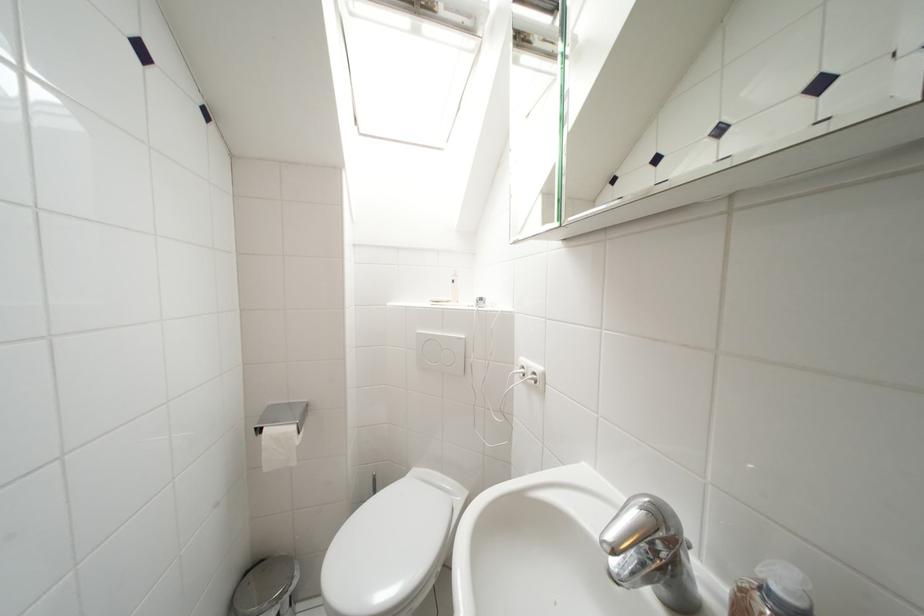
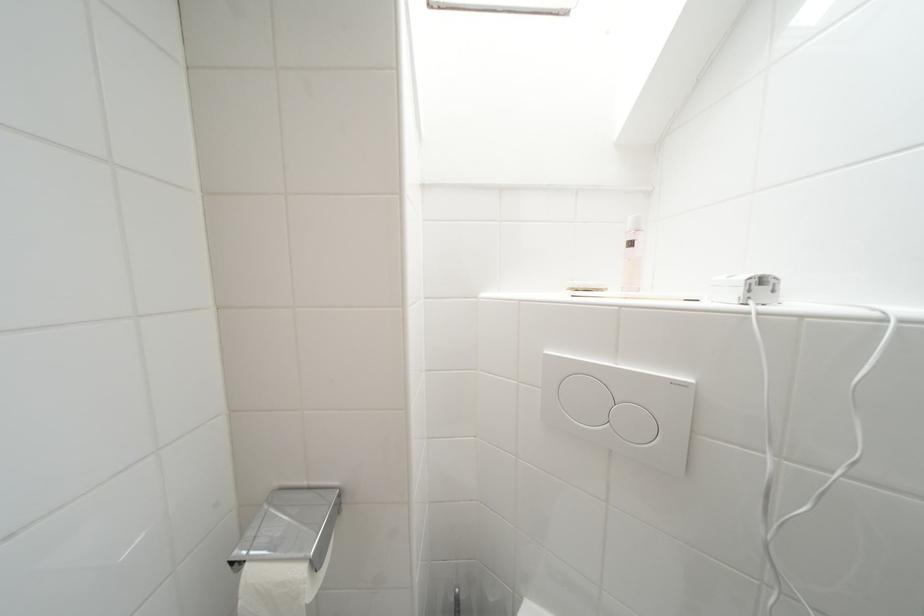
The images are taken continuously from a first-person perspective. In which direction are you moving?

The cameraman moved toward left, forward.